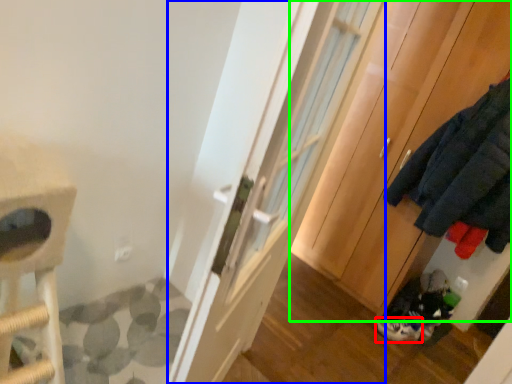
Question: Based on their relative distances, which object is nearer to footwear (highlighted by a red box)? Choose from door (highlighted by a blue box) and cabinetry (highlighted by a green box).

Choices:
 (A) door
 (B) cabinetry

Answer: (B)